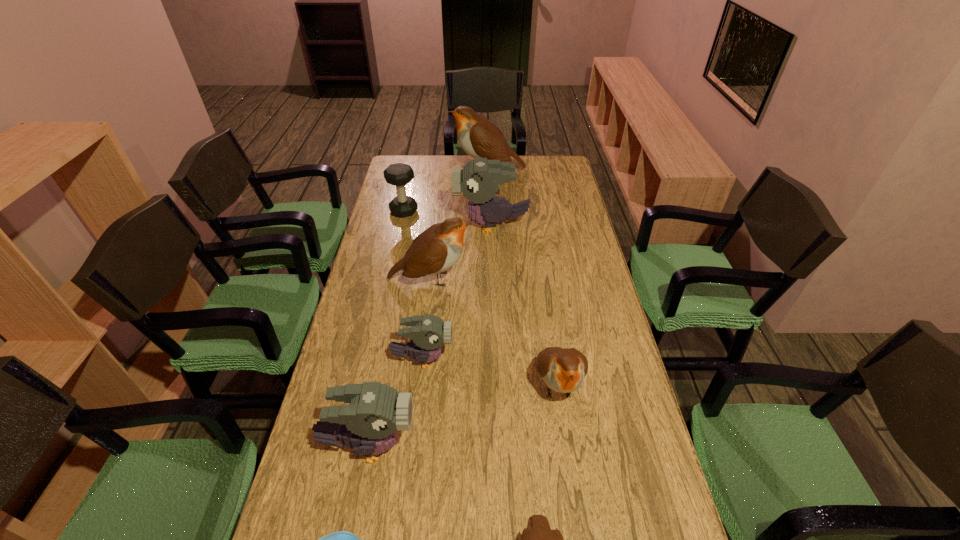
Locate an element on the screen. vacant region between the nearest gray bird and the fourth farthest object is located at coordinates (400, 362).

Find the location of `object that is the fourth closest to the nearest bird`. object that is the fourth closest to the nearest bird is located at coordinates (429, 332).

This screenshot has width=960, height=540. Find the location of `object that can be found as the closest to the second farthest bird`. object that can be found as the closest to the second farthest bird is located at coordinates (399, 174).

Point out which bird is positioned as the third nearest to the second nearest gray bird. Please provide its 2D coordinates. Your answer should be formatted as a tuple, i.e. [(x, y)], where the tuple contains the x and y coordinates of a point satisfying the conditions above.

[(435, 250)]

Where is `bird identified as the closest to the second farthest bird`? bird identified as the closest to the second farthest bird is located at coordinates (435, 250).

Identify which brown bird is the third closest to the third farthest brown bird. Please provide its 2D coordinates. Your answer should be formatted as a tuple, i.e. [(x, y)], where the tuple contains the x and y coordinates of a point satisfying the conditions above.

[(479, 138)]

Locate an element on the screen. The width and height of the screenshot is (960, 540). the third closest brown bird to the sixth nearest object is located at coordinates (540, 539).

Identify which gray bird is the second closest to the nearest brown bird. Please provide its 2D coordinates. Your answer should be formatted as a tuple, i.e. [(x, y)], where the tuple contains the x and y coordinates of a point satisfying the conditions above.

[(429, 332)]

Find the location of a particular element. gray bird that is the second closest to the mug is located at coordinates (429, 332).